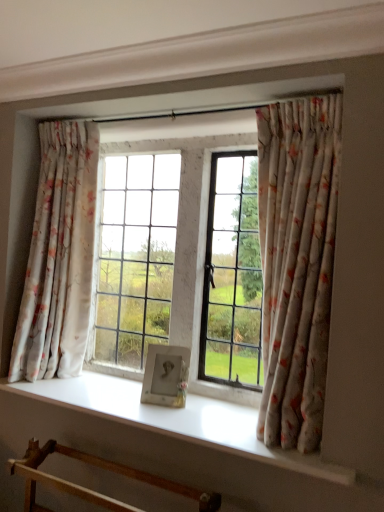
Where is `floral fabric curtain at right, marked as the first curtain in a right-to-left arrangement`? The width and height of the screenshot is (384, 512). floral fabric curtain at right, marked as the first curtain in a right-to-left arrangement is located at coordinates (297, 263).

How much space does floral fabric curtain at left, arranged as the 2th curtain when viewed from the front, occupy vertically?

It is 1.23 meters.

The height and width of the screenshot is (512, 384). Find the location of `white smooth window sill at center`. white smooth window sill at center is located at coordinates (176, 420).

From a real-world perspective, between floral fabric curtain at left, which ranks as the first curtain in back-to-front order, and wooden frame at lower left, who is vertically lower?

From a 3D spatial view, wooden frame at lower left is below.

Is floral fabric curtain at left, arranged as the first curtain when viewed from the left, taller than wooden frame at lower left?

Indeed, floral fabric curtain at left, arranged as the first curtain when viewed from the left, has a greater height compared to wooden frame at lower left.

Consider the image. Which object is wider, floral fabric curtain at left, which appears as the second curtain when viewed from the right, or wooden frame at lower left?

Wider between the two is wooden frame at lower left.

Which point is more forward, (x=53, y=374) or (x=31, y=452)?

The point (x=31, y=452) is more forward.

Where is `curtain below the floral fabric curtain at left, arranged as the first curtain when viewed from the left (from the image's perspective)`? curtain below the floral fabric curtain at left, arranged as the first curtain when viewed from the left (from the image's perspective) is located at coordinates (297, 263).

Is floral fabric curtain at left, arranged as the first curtain when viewed from the left, turned away from floral fabric curtain at right, the first curtain from the front?

No, floral fabric curtain at left, arranged as the first curtain when viewed from the left, is not facing away from floral fabric curtain at right, the first curtain from the front.

Which is more to the right, floral fabric curtain at left, arranged as the first curtain when viewed from the left, or floral fabric curtain at right, which ranks as the 2th curtain in left-to-right order?

Positioned to the right is floral fabric curtain at right, which ranks as the 2th curtain in left-to-right order.

Does wooden frame at lower left lie behind floral fabric curtain at right, the first curtain from the front?

No, wooden frame at lower left is in front of floral fabric curtain at right, the first curtain from the front.

Is point (15, 463) closer or farther from the camera than point (279, 444)?

Point (15, 463).

Is wooden frame at lower left facing away from floral fabric curtain at right, the first curtain from the front?

wooden frame at lower left does not have its back to floral fabric curtain at right, the first curtain from the front.

Considering the relative sizes of wooden frame at lower left and floral fabric curtain at right, which ranks as the 2th curtain in left-to-right order, in the image provided, is wooden frame at lower left wider than floral fabric curtain at right, which ranks as the 2th curtain in left-to-right order,?

Yes.

Is floral fabric curtain at right, marked as the first curtain in a right-to-left arrangement, taller or shorter than white smooth window sill at center?

floral fabric curtain at right, marked as the first curtain in a right-to-left arrangement, is taller than white smooth window sill at center.

Is white smooth window sill at center at the back of floral fabric curtain at right, which appears as the second curtain when viewed from the back?

No, floral fabric curtain at right, which appears as the second curtain when viewed from the back, is not facing the opposite direction of white smooth window sill at center.

Is floral fabric curtain at right, which appears as the second curtain when viewed from the back, touching white smooth window sill at center?

floral fabric curtain at right, which appears as the second curtain when viewed from the back, and white smooth window sill at center are not in contact.

Can you confirm if floral fabric curtain at right, marked as the first curtain in a right-to-left arrangement, is wider than white smooth window sill at center?

Incorrect, the width of floral fabric curtain at right, marked as the first curtain in a right-to-left arrangement, does not surpass that of white smooth window sill at center.

Is wooden frame at lower left positioned beyond the bounds of white smooth window sill at center?

wooden frame at lower left lies outside white smooth window sill at center's area.

Consider the image. From the image's perspective, which one is positioned higher, wooden frame at lower left or white smooth window sill at center?

white smooth window sill at center is shown above in the image.

Is the surface of wooden frame at lower left in direct contact with white smooth window sill at center?

They are not placed beside each other.

Is the depth of wooden frame at lower left greater than that of white smooth window sill at center?

No, it is in front of white smooth window sill at center.

Which point is more distant from viewer, [63,380] or [288,345]?

Positioned behind is point [63,380].

Are white smooth window sill at center and floral fabric curtain at right, which appears as the second curtain when viewed from the back, located far from each other?

They are positioned close to each other.

The image size is (384, 512). Find the location of `window sill located below the floral fabric curtain at right, which appears as the second curtain when viewed from the back (from the image's perspective)`. window sill located below the floral fabric curtain at right, which appears as the second curtain when viewed from the back (from the image's perspective) is located at coordinates (176, 420).

Which is more to the left, white smooth window sill at center or floral fabric curtain at right, marked as the first curtain in a right-to-left arrangement?

From the viewer's perspective, white smooth window sill at center appears more on the left side.

Can you confirm if floral fabric curtain at right, marked as the first curtain in a right-to-left arrangement, is shorter than floral fabric curtain at left, arranged as the 2th curtain when viewed from the front?

In fact, floral fabric curtain at right, marked as the first curtain in a right-to-left arrangement, may be taller than floral fabric curtain at left, arranged as the 2th curtain when viewed from the front.

Is floral fabric curtain at right, which ranks as the 2th curtain in left-to-right order, inside the boundaries of floral fabric curtain at left, which appears as the second curtain when viewed from the right, or outside?

floral fabric curtain at right, which ranks as the 2th curtain in left-to-right order, is spatially situated outside floral fabric curtain at left, which appears as the second curtain when viewed from the right.

From the picture: Can you confirm if floral fabric curtain at right, marked as the first curtain in a right-to-left arrangement, is thinner than floral fabric curtain at left, arranged as the first curtain when viewed from the left?

Yes, floral fabric curtain at right, marked as the first curtain in a right-to-left arrangement, is thinner than floral fabric curtain at left, arranged as the first curtain when viewed from the left.

Is floral fabric curtain at right, the first curtain from the front, with floral fabric curtain at left, arranged as the first curtain when viewed from the left?

No, floral fabric curtain at right, the first curtain from the front, is not with floral fabric curtain at left, arranged as the first curtain when viewed from the left.

Identify the location of curtain that is the 2nd one when counting backward from the wooden frame at lower left. The width and height of the screenshot is (384, 512). (59, 256).

Image resolution: width=384 pixels, height=512 pixels. What are the coordinates of `curtain on the right of floral fabric curtain at left, arranged as the first curtain when viewed from the left` in the screenshot? It's located at (297, 263).

From the picture: Based on their spatial positions, is wooden frame at lower left or white smooth window sill at center further from floral fabric curtain at right, which appears as the second curtain when viewed from the back?

The object further to floral fabric curtain at right, which appears as the second curtain when viewed from the back, is wooden frame at lower left.

Based on their spatial positions, is floral fabric curtain at left, which appears as the second curtain when viewed from the right, or wooden frame at lower left further from white smooth window sill at center?

floral fabric curtain at left, which appears as the second curtain when viewed from the right, is positioned further to the anchor white smooth window sill at center.

Estimate the real-world distances between objects in this image. Which object is closer to white smooth window sill at center, wooden frame at lower left or floral fabric curtain at left, arranged as the first curtain when viewed from the left?

Based on the image, wooden frame at lower left appears to be nearer to white smooth window sill at center.

When comparing their distances from white smooth window sill at center, does wooden frame at lower left or floral fabric curtain at right, marked as the first curtain in a right-to-left arrangement, seem further?

Based on the image, floral fabric curtain at right, marked as the first curtain in a right-to-left arrangement, appears to be further to white smooth window sill at center.

From the image, which object appears to be farther from wooden frame at lower left, floral fabric curtain at right, marked as the first curtain in a right-to-left arrangement, or floral fabric curtain at left, arranged as the 2th curtain when viewed from the front?

Among the two, floral fabric curtain at right, marked as the first curtain in a right-to-left arrangement, is located further to wooden frame at lower left.

Which object lies nearer to the anchor point wooden frame at lower left, floral fabric curtain at left, arranged as the 2th curtain when viewed from the front, or floral fabric curtain at right, marked as the first curtain in a right-to-left arrangement?

The object closer to wooden frame at lower left is floral fabric curtain at left, arranged as the 2th curtain when viewed from the front.

When comparing their distances from wooden frame at lower left, does floral fabric curtain at right, the first curtain from the front, or white smooth window sill at center seem closer?

white smooth window sill at center is closer to wooden frame at lower left.

Which object lies nearer to the anchor point white smooth window sill at center, floral fabric curtain at left, arranged as the first curtain when viewed from the left, or floral fabric curtain at right, marked as the first curtain in a right-to-left arrangement?

Based on the image, floral fabric curtain at right, marked as the first curtain in a right-to-left arrangement, appears to be nearer to white smooth window sill at center.

Identify the location of curtain between floral fabric curtain at left, which ranks as the first curtain in back-to-front order, and wooden frame at lower left vertically. The width and height of the screenshot is (384, 512). (297, 263).

Locate an element on the screen. Image resolution: width=384 pixels, height=512 pixels. window sill between floral fabric curtain at left, which ranks as the first curtain in back-to-front order, and wooden frame at lower left, in the vertical direction is located at coordinates (176, 420).

Identify the location of window sill between floral fabric curtain at right, marked as the first curtain in a right-to-left arrangement, and wooden frame at lower left in the up-down direction. The width and height of the screenshot is (384, 512). (176, 420).

This screenshot has width=384, height=512. I want to click on window sill between floral fabric curtain at left, which ranks as the first curtain in back-to-front order, and floral fabric curtain at right, the first curtain from the front, so click(x=176, y=420).